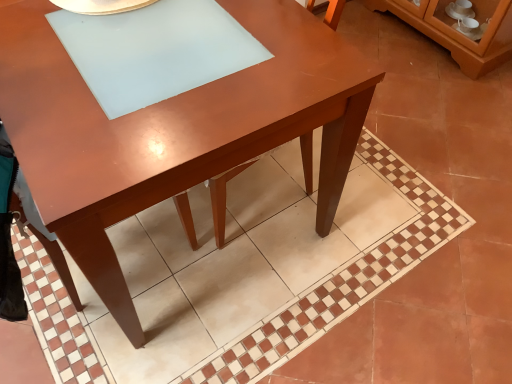
At what (x,y) coordinates should I click in order to perform the action: click on matte brown table at center. Please return your answer as a coordinate pair (x, y). This screenshot has width=512, height=384. Looking at the image, I should click on (172, 129).

This screenshot has width=512, height=384. What do you see at coordinates (172, 129) in the screenshot?
I see `matte brown table at center` at bounding box center [172, 129].

Describe the element at coordinates (458, 32) in the screenshot. I see `brown glossy cabinet at upper right` at that location.

The width and height of the screenshot is (512, 384). I want to click on brown glossy cabinet at upper right, so click(458, 32).

You are a GUI agent. You are given a task and a screenshot of the screen. Output one action in this format:
    pyautogui.click(x=<x>, y=<y>)
    Task: Click on the matte brown table at center
    
    Given the screenshot: What is the action you would take?
    pyautogui.click(x=172, y=129)

Based on their positions, is matte brown table at center located to the left or right of brown glossy cabinet at upper right?

matte brown table at center is positioned on brown glossy cabinet at upper right's left side.

Is matte brown table at center positioned behind brown glossy cabinet at upper right?

No, the depth of matte brown table at center is less than that of brown glossy cabinet at upper right.

Does point (367, 66) lie behind point (481, 71)?

No, (367, 66) is closer to viewer.

From the image's perspective, is matte brown table at center above brown glossy cabinet at upper right?

No, from the image's perspective, matte brown table at center is not on top of brown glossy cabinet at upper right.

From a real-world perspective, relative to brown glossy cabinet at upper right, is matte brown table at center vertically above or below?

matte brown table at center is above brown glossy cabinet at upper right.

Looking at this image, considering the relative sizes of matte brown table at center and brown glossy cabinet at upper right in the image provided, is matte brown table at center wider than brown glossy cabinet at upper right?

Yes.

Is matte brown table at center taller or shorter than brown glossy cabinet at upper right?

In the image, matte brown table at center appears to be taller than brown glossy cabinet at upper right.

Can you confirm if matte brown table at center is bigger than brown glossy cabinet at upper right?

Yes.

Based on the photo, is brown glossy cabinet at upper right inside matte brown table at center?

No, brown glossy cabinet at upper right is not surrounded by matte brown table at center.

Is matte brown table at center not close to brown glossy cabinet at upper right?

Yes.

Is brown glossy cabinet at upper right at the back of matte brown table at center?

No, brown glossy cabinet at upper right is not at the back of matte brown table at center.

How different are the orientations of matte brown table at center and brown glossy cabinet at upper right in degrees?

The angular difference between matte brown table at center and brown glossy cabinet at upper right is 178 degrees.

I want to click on dresser lying above the matte brown table at center (from the image's perspective), so click(458, 32).

Which object is positioned more to the left, brown glossy cabinet at upper right or matte brown table at center?

matte brown table at center is more to the left.

From the picture: Which object is closer to the camera, brown glossy cabinet at upper right or matte brown table at center?

matte brown table at center is closer to the camera.

Is point (475, 47) farther from camera compared to point (81, 138)?

Yes.

From the image's perspective, is brown glossy cabinet at upper right above or below matte brown table at center?

From the image's perspective, brown glossy cabinet at upper right appears above matte brown table at center.

From a real-world perspective, who is located higher, brown glossy cabinet at upper right or matte brown table at center?

In real-world perspective, matte brown table at center is above.

Can you confirm if brown glossy cabinet at upper right is thinner than matte brown table at center?

Yes.

From their relative heights in the image, would you say brown glossy cabinet at upper right is taller or shorter than matte brown table at center?

In the image, brown glossy cabinet at upper right appears to be shorter than matte brown table at center.

Who is bigger, brown glossy cabinet at upper right or matte brown table at center?

With larger size is matte brown table at center.

Is matte brown table at center completely or partially inside brown glossy cabinet at upper right?

That's incorrect, matte brown table at center is not inside brown glossy cabinet at upper right.

In the scene shown: Can you see brown glossy cabinet at upper right touching matte brown table at center?

No, brown glossy cabinet at upper right is not next to matte brown table at center.

Is matte brown table at center at the back of brown glossy cabinet at upper right?

No.

What's the angular difference between brown glossy cabinet at upper right and matte brown table at center's facing directions?

brown glossy cabinet at upper right and matte brown table at center are facing 178 degrees away from each other.

Measure the distance from brown glossy cabinet at upper right to matte brown table at center.

The distance of brown glossy cabinet at upper right from matte brown table at center is 1.61 meters.

The width and height of the screenshot is (512, 384). What are the coordinates of `table below the brown glossy cabinet at upper right (from the image's perspective)` in the screenshot? It's located at (172, 129).

Where is `dresser on the right side of matte brown table at center`? dresser on the right side of matte brown table at center is located at coordinates (458, 32).

At what (x,y) coordinates should I click in order to perform the action: click on table that is above the brown glossy cabinet at upper right (from a real-world perspective). Please return your answer as a coordinate pair (x, y). Looking at the image, I should click on (172, 129).